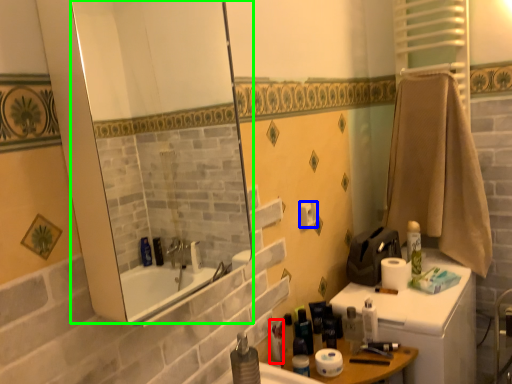
Question: Based on their relative distances, which object is nearer to toiletry (highlighted by a red box)? Choose from toilet paper (highlighted by a blue box) and mirror (highlighted by a green box).

Choices:
 (A) toilet paper
 (B) mirror

Answer: (A)